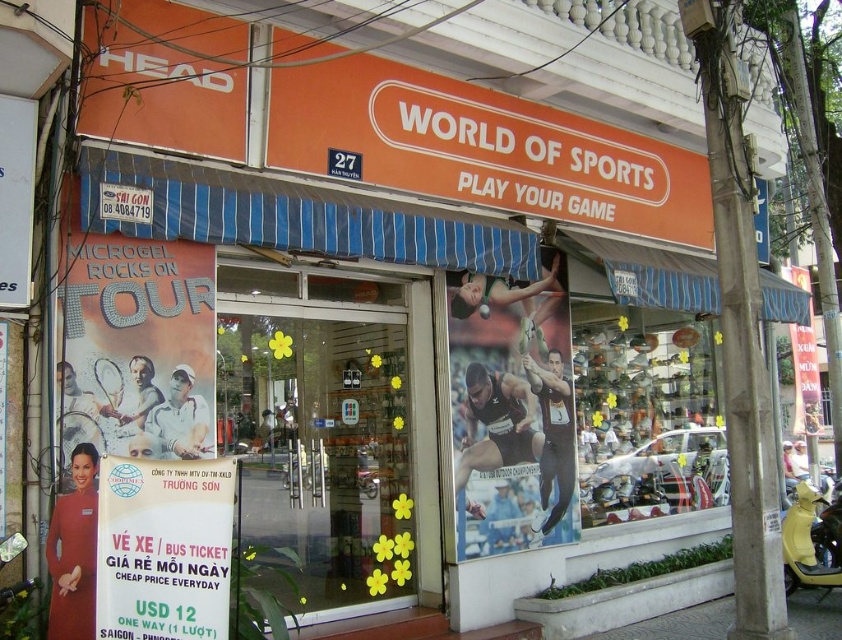
Who is shorter, transparent glass door at center or white paper sign at lower left?

With less height is white paper sign at lower left.

Is transparent glass door at center bigger than white paper sign at lower left?

Yes.

Describe the element at coordinates (321, 449) in the screenshot. I see `transparent glass door at center` at that location.

Identify the location of transparent glass door at center. (321, 449).

Does yellow paper poster at left appear over metallic silver shoes at center?

Yes, yellow paper poster at left is above metallic silver shoes at center.

Find the location of a particular element. This screenshot has width=842, height=640. yellow paper poster at left is located at coordinates (137, 346).

Is point (110, 328) positioned before point (643, 365)?

Yes, point (110, 328) is in front of point (643, 365).

Find the location of a particular element. yellow paper poster at left is located at coordinates (137, 346).

Based on the photo, can you confirm if transparent glass door at center is positioned below matte black poster at center?

Correct, transparent glass door at center is located below matte black poster at center.

Does point (366, 419) come closer to viewer compared to point (521, 500)?

Yes, it is in front of point (521, 500).

Locate an element on the screen. transparent glass door at center is located at coordinates (321, 449).

Identify the location of transparent glass door at center. Image resolution: width=842 pixels, height=640 pixels. (321, 449).